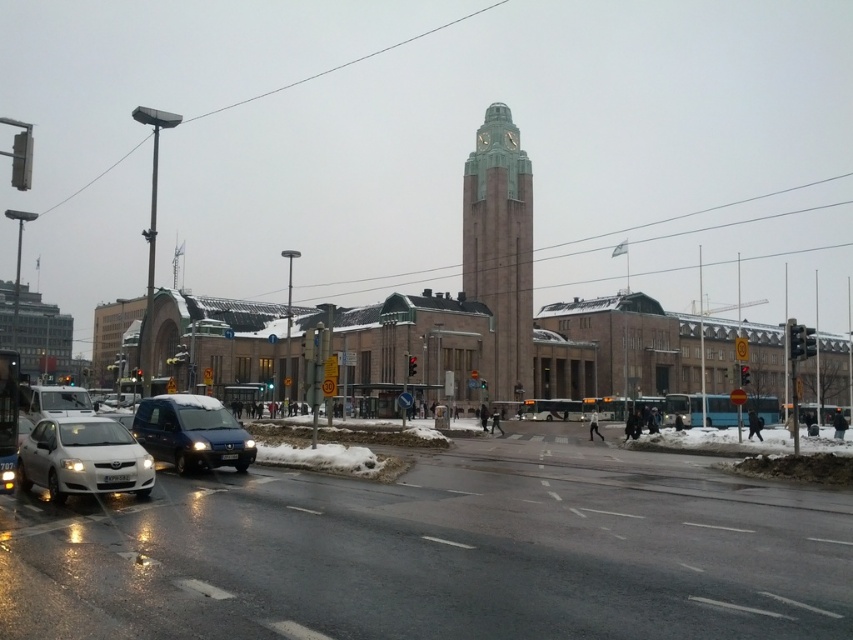
You are standing at the edge of the wet road in the bustling urban scene. You want to take a photo of the green stone clock tower at center. Which direction should you face to ensure the clock tower is in the center of your photo?

The green stone clock tower at center is located at point coordinates, so you should face directly towards the center of the scene to capture it in the center of your photo.

You are a delivery driver needing to park your sleek metallic van at center in a spot that can accommodate its width. The parking spot you found is designed for vehicles narrower than the green stone clock tower at center. Can your van fit in this spot?

The green stone clock tower at center is wider than the sleek metallic van at center. Since the parking spot is for vehicles narrower than the clock tower, the sleek metallic van at center can fit in the spot.

You are driving a delivery truck and need to park near the green stone clock tower at center. You see the sleek metallic van at center blocking your path. Can you drive around the van to reach the clock tower?

The green stone clock tower at center is positioned on the right side of the sleek metallic van at center. Since the van is blocking the path, you can drive around the van to the right side to reach the clock tower.